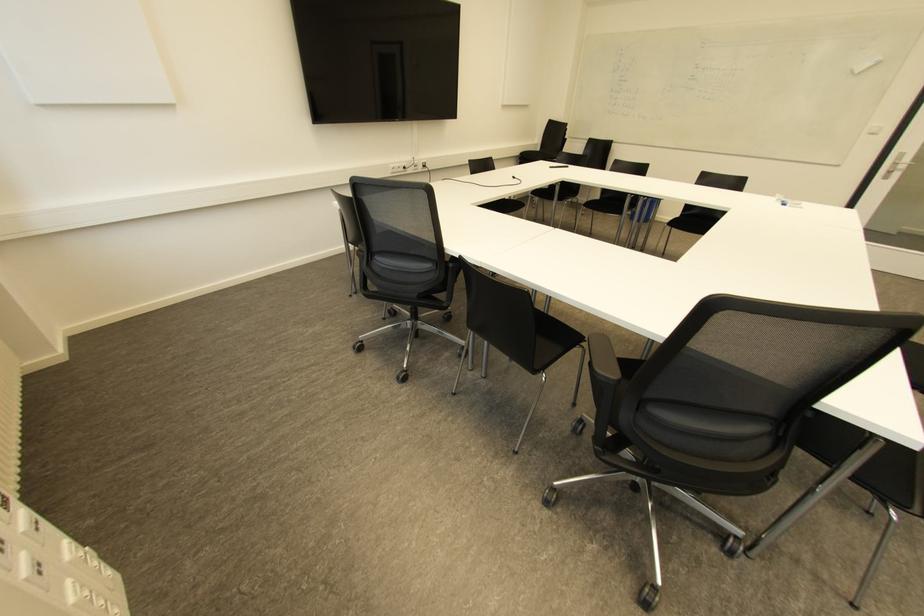
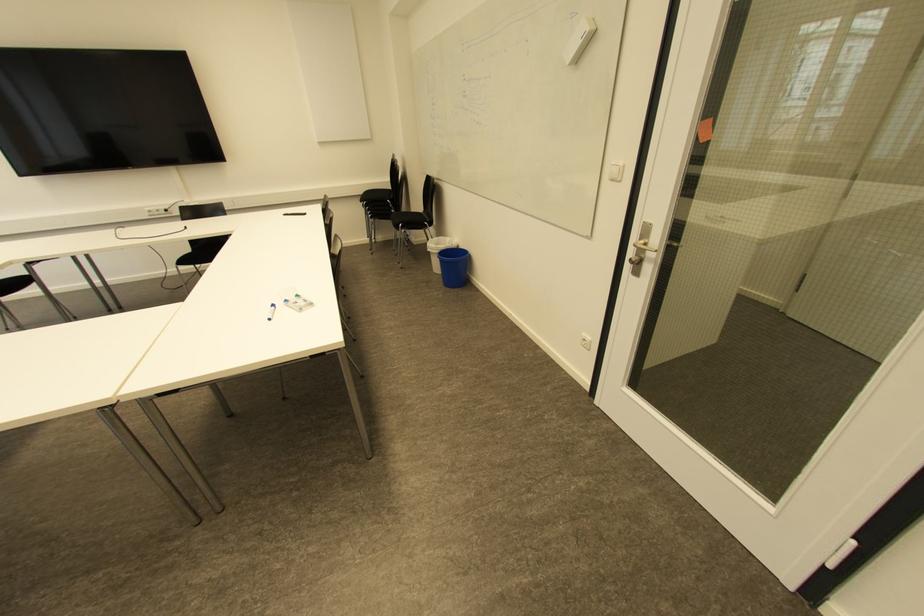
Find the pixel in the second image that matches point (890, 172) in the first image.

(638, 262)